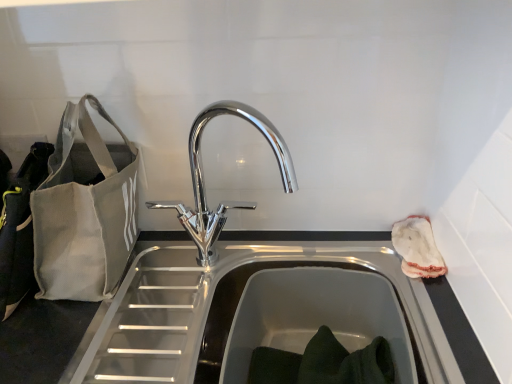
The image size is (512, 384). Find the location of `gray canvas bag at left`. gray canvas bag at left is located at coordinates (84, 211).

The width and height of the screenshot is (512, 384). What are the coordinates of `chrome metallic faucet at center` in the screenshot? It's located at (203, 181).

The height and width of the screenshot is (384, 512). In order to click on gray canvas bag at left in this screenshot , I will do `click(84, 211)`.

Between chrome metallic faucet at center and gray canvas bag at left, which one has larger size?

With larger size is gray canvas bag at left.

Where is `bag on the left of chrome metallic faucet at center`? bag on the left of chrome metallic faucet at center is located at coordinates (84, 211).

Considering the sizes of objects chrome metallic faucet at center and gray canvas bag at left in the image provided, who is wider, chrome metallic faucet at center or gray canvas bag at left?

gray canvas bag at left is wider.

Can you confirm if chrome metallic faucet at center is shorter than gray canvas bag at left?

Yes, chrome metallic faucet at center is shorter than gray canvas bag at left.

Is point (196, 242) less distant than point (397, 231)?

No, (196, 242) is behind (397, 231).

Considering the relative sizes of chrome metallic faucet at center and white fabric pouch at right in the image provided, is chrome metallic faucet at center thinner than white fabric pouch at right?

Incorrect, the width of chrome metallic faucet at center is not less than that of white fabric pouch at right.

Does chrome metallic faucet at center have a smaller size compared to white fabric pouch at right?

No, chrome metallic faucet at center is not smaller than white fabric pouch at right.

In the scene shown: Can you tell me how much white fabric pouch at right and chrome metallic faucet at center differ in facing direction?

There is a 92.7-degree angle between the facing directions of white fabric pouch at right and chrome metallic faucet at center.

Is white fabric pouch at right with chrome metallic faucet at center?

white fabric pouch at right is not next to chrome metallic faucet at center, and they're not touching.

Is white fabric pouch at right oriented towards chrome metallic faucet at center?

Yes.

Identify the location of tap that is on the left side of white fabric pouch at right. (203, 181).

Considering the sizes of objects gray canvas bag at left and chrome metallic faucet at center in the image provided, who is taller, gray canvas bag at left or chrome metallic faucet at center?

gray canvas bag at left is taller.

From a real-world perspective, who is located higher, gray canvas bag at left or chrome metallic faucet at center?

Answer: In real-world perspective, gray canvas bag at left is above.

Is gray canvas bag at left smaller than chrome metallic faucet at center?

No, gray canvas bag at left is not smaller than chrome metallic faucet at center.

From the image's perspective, is gray canvas bag at left located above or below chrome metallic faucet at center?

From the image's perspective, gray canvas bag at left appears above chrome metallic faucet at center.

Locate an element on the screen. pouch beneath the gray canvas bag at left (from a real-world perspective) is located at coordinates (417, 248).

How different are the orientations of white fabric pouch at right and gray canvas bag at left in degrees?

The angular difference between white fabric pouch at right and gray canvas bag at left is 90.9 degrees.

Is white fabric pouch at right facing towards gray canvas bag at left?

Yes, white fabric pouch at right faces towards gray canvas bag at left.

Looking at this image, from the image's perspective, between white fabric pouch at right and gray canvas bag at left, who is located below?

white fabric pouch at right.

Based on the photo, considering the sizes of objects gray canvas bag at left and white fabric pouch at right in the image provided, who is taller, gray canvas bag at left or white fabric pouch at right?

gray canvas bag at left is taller.

Which is closer, (48, 229) or (444, 271)?

The point (48, 229) is closer to the camera.

From a real-world perspective, is gray canvas bag at left physically located above or below white fabric pouch at right?

In terms of real-world spatial position, gray canvas bag at left is above white fabric pouch at right.

Locate an element on the screen. The image size is (512, 384). pouch beneath the gray canvas bag at left (from a real-world perspective) is located at coordinates (417, 248).

I want to click on tap behind the gray canvas bag at left, so click(203, 181).

The height and width of the screenshot is (384, 512). I want to click on pouch that appears on the right of chrome metallic faucet at center, so click(x=417, y=248).

From the image, which object appears to be nearer to gray canvas bag at left, chrome metallic faucet at center or white fabric pouch at right?

Based on the image, chrome metallic faucet at center appears to be nearer to gray canvas bag at left.

Looking at the image, which one is located closer to chrome metallic faucet at center, gray canvas bag at left or white fabric pouch at right?

gray canvas bag at left.

Based on their spatial positions, is chrome metallic faucet at center or gray canvas bag at left closer to white fabric pouch at right?

Based on the image, chrome metallic faucet at center appears to be nearer to white fabric pouch at right.

Estimate the real-world distances between objects in this image. Which object is further from gray canvas bag at left, white fabric pouch at right or chrome metallic faucet at center?

white fabric pouch at right is further to gray canvas bag at left.

Estimate the real-world distances between objects in this image. Which object is further from white fabric pouch at right, gray canvas bag at left or chrome metallic faucet at center?

gray canvas bag at left lies further to white fabric pouch at right than the other object.

Based on their spatial positions, is white fabric pouch at right or gray canvas bag at left closer to chrome metallic faucet at center?

gray canvas bag at left lies closer to chrome metallic faucet at center than the other object.

This screenshot has height=384, width=512. In order to click on tap between gray canvas bag at left and white fabric pouch at right in this screenshot , I will do `click(203, 181)`.